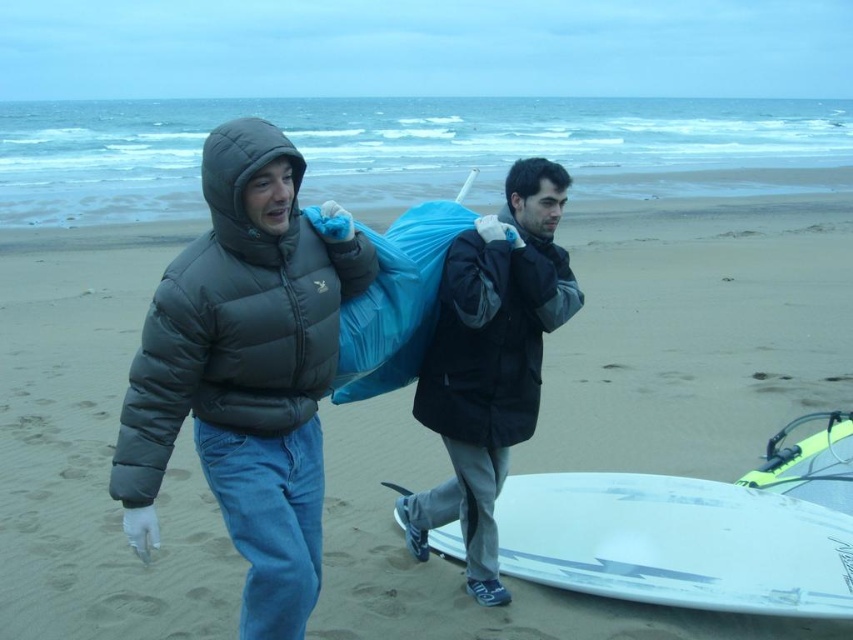
You are standing at the camera position and want to pick up an item located at point (x=677, y=492). If you can walk 1.5 meters per second, how long will it take you to reach that point?

The point is 4.44 meters away from the camera. At a walking speed of 1.5 meters per second, it would take approximately 2.96 seconds to reach the point.

You are a photographer positioned at the edge of the beach, aiming to capture a photo of the two individuals carrying trash bags. The white glossy surfboard at lower center is in your frame. To ensure the surfboard doesn not obstruct the main subjects, should you adjust your camera angle upwards or downwards?

The white glossy surfboard at lower center is located at point (686, 538), which is closer to the lower part of the frame. To avoid obstruction, you should adjust your camera angle upwards to position the main subjects above the surfboard.